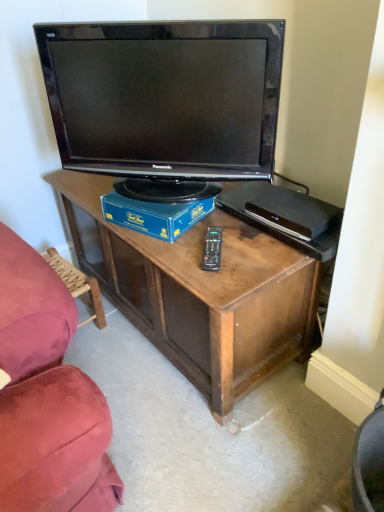
Locate an element on the screen. The image size is (384, 512). vacant region above blue cardboard box at center (from a real-world perspective) is located at coordinates (162, 191).